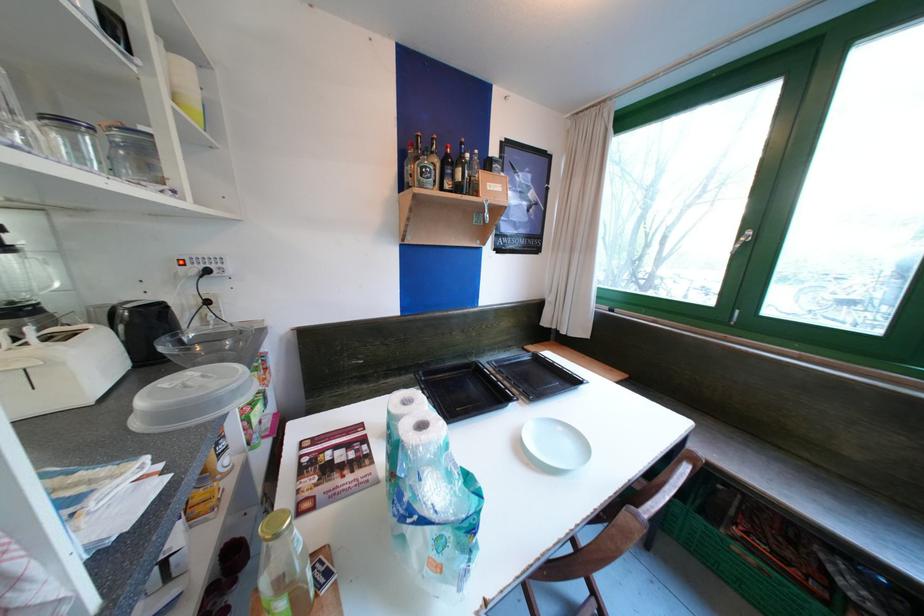
This screenshot has width=924, height=616. What are the coordinates of `silver window handle` in the screenshot? It's located at (742, 240).